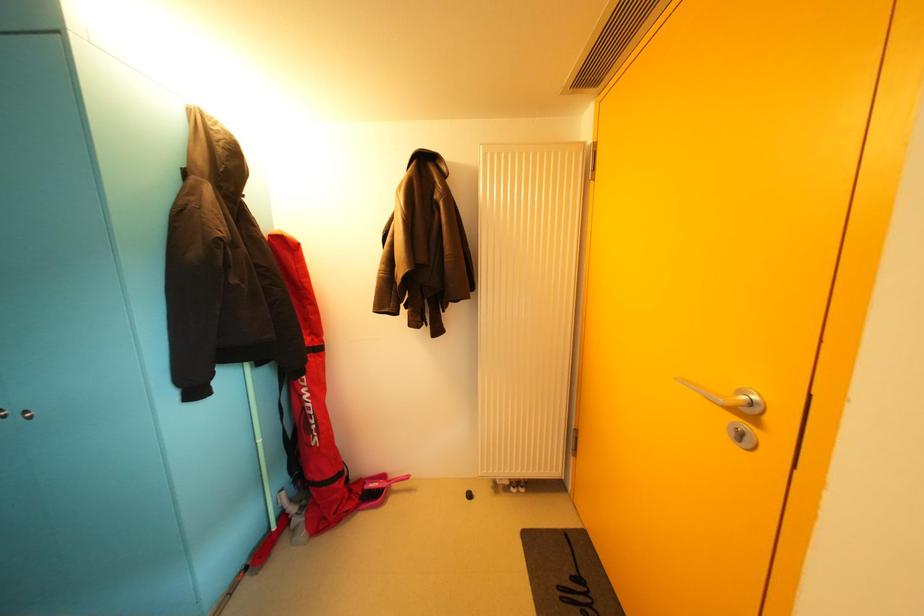
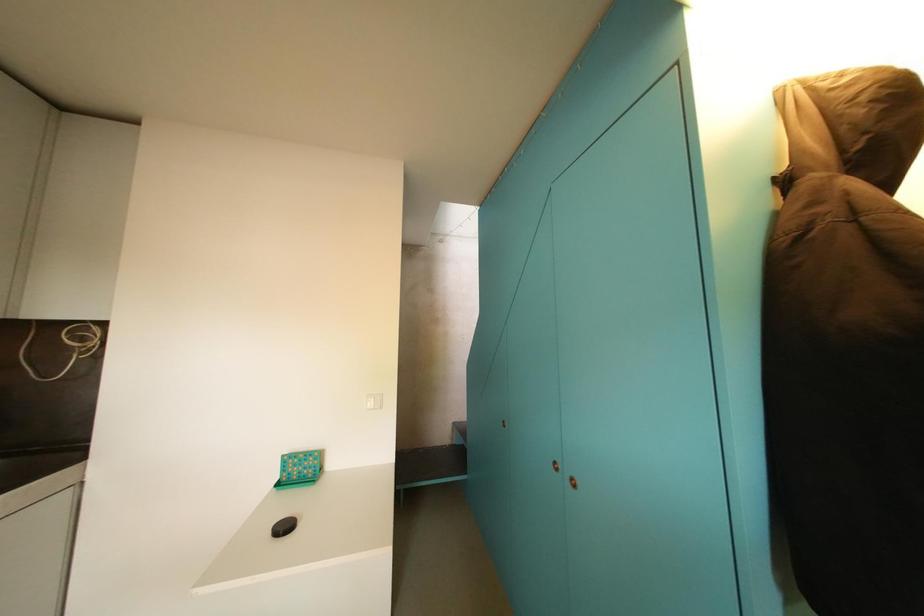
Question: How did the camera likely rotate?

Choices:
 (A) Left
 (B) Right
 (C) Up
 (D) Down

Answer: (A)